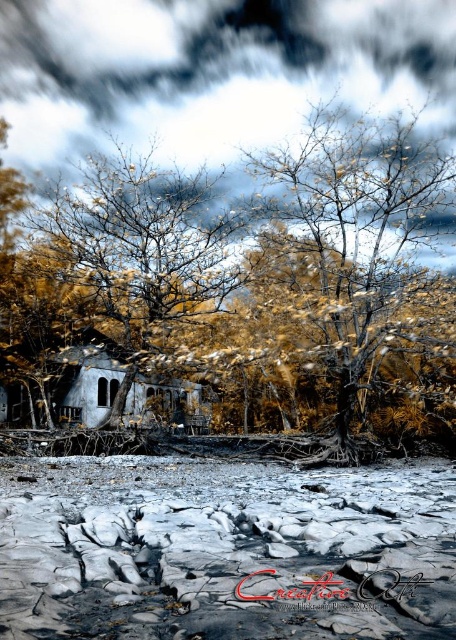
You are an explorer in this surreal landscape. You need to locate the golden textured tree at center. According to the coordinates provided, where exactly is this tree positioned in the image?

The golden textured tree at center is located at coordinates point [359,227].